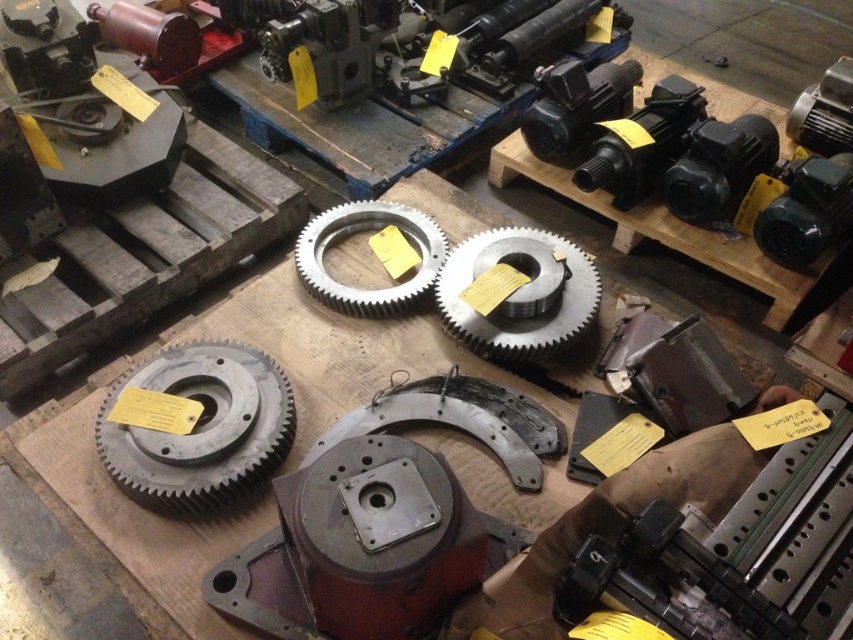
Question: Among these objects, which one is farthest from the camera?

Choices:
 (A) gray metallic gear at center
 (B) metallic gray gear at center
 (C) matte gray gear at center

Answer: (C)

Question: Considering the relative positions of gray metallic gear at center and matte gray gear at center in the image provided, where is gray metallic gear at center located with respect to matte gray gear at center?

Choices:
 (A) below
 (B) above

Answer: (A)

Question: Which point appears farthest from the camera in this image?

Choices:
 (A) (189, 483)
 (B) (556, 346)

Answer: (B)

Question: Does gray metallic gear at center have a greater width compared to metallic gray gear at center?

Choices:
 (A) yes
 (B) no

Answer: (A)

Question: Is gray metallic gear at center smaller than metallic gray gear at center?

Choices:
 (A) no
 (B) yes

Answer: (A)

Question: Which object appears closest to the camera in this image?

Choices:
 (A) matte gray gear at center
 (B) gray metallic gear at center

Answer: (B)